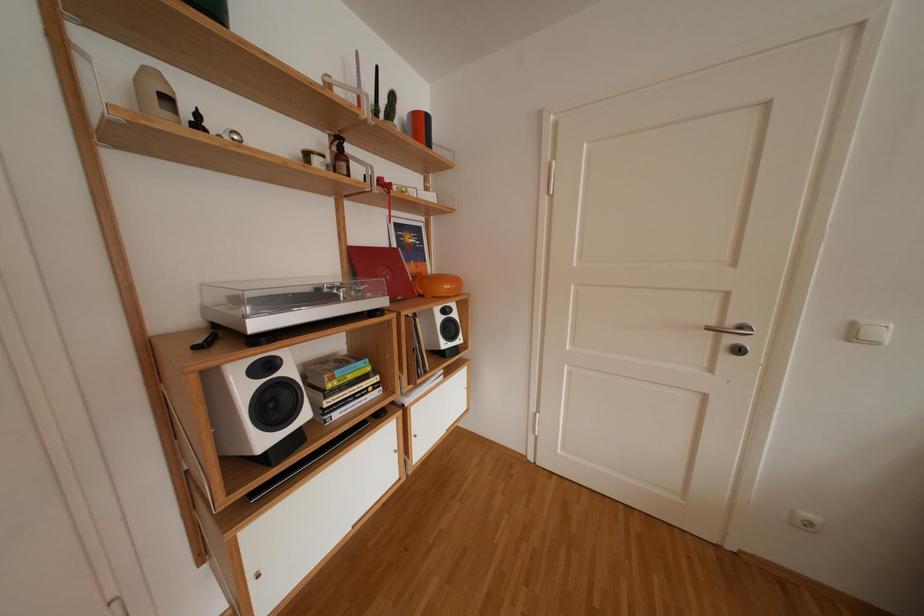
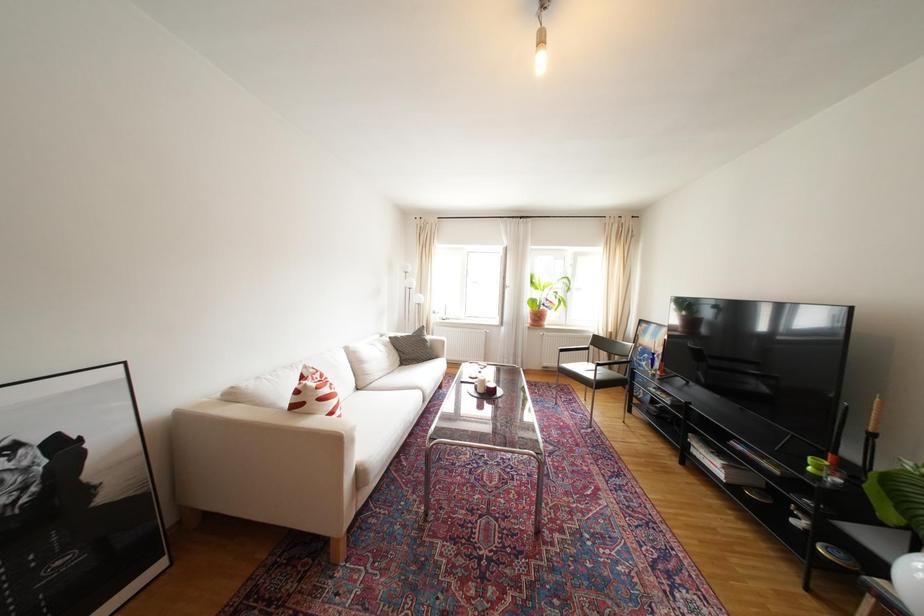
Question: The camera is either moving clockwise (left) or counter-clockwise (right) around the object. The first image is from the beginning of the video and the second image is from the end. Is the camera moving left or right when shooting the video?

Choices:
 (A) Left
 (B) Right

Answer: (A)